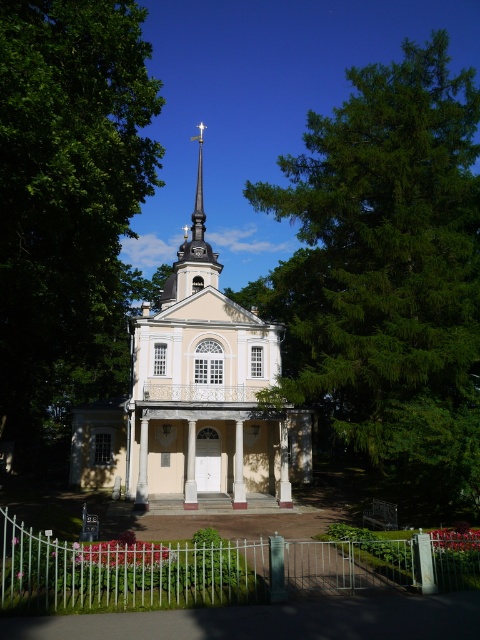
Question: Is white glossy church at center to the right of green wrought iron gate at lower center from the viewer's perspective?

Choices:
 (A) yes
 (B) no

Answer: (B)

Question: Among these points, which one is nearest to the camera?

Choices:
 (A) (254, 550)
 (B) (187, 266)

Answer: (A)

Question: Estimate the real-world distances between objects in this image. Which object is farther from the smooth silver spire at center?

Choices:
 (A) green wrought iron gate at lower center
 (B) green leafy tree at center
 (C) green leafy tree at upper right
 (D) white glossy church at center

Answer: (A)

Question: Is green leafy tree at upper right wider than green wrought iron gate at lower center?

Choices:
 (A) yes
 (B) no

Answer: (A)

Question: Does green leafy tree at upper right lie behind white glossy church at center?

Choices:
 (A) no
 (B) yes

Answer: (A)

Question: Which object is positioned closest to the smooth silver spire at center?

Choices:
 (A) white glossy church at center
 (B) green wrought iron gate at lower center
 (C) green leafy tree at upper right

Answer: (A)